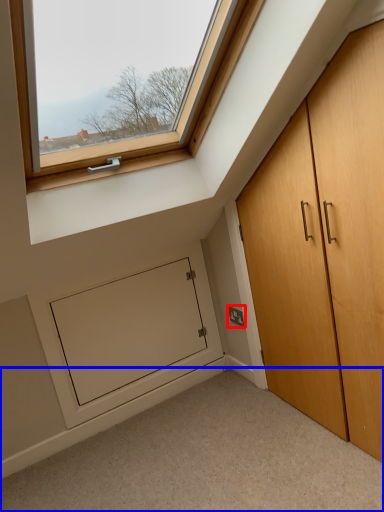
Question: Which object is closer to the camera taking this photo, electric outlet (highlighted by a red box) or corridor (highlighted by a blue box)?

Choices:
 (A) electric outlet
 (B) corridor

Answer: (B)